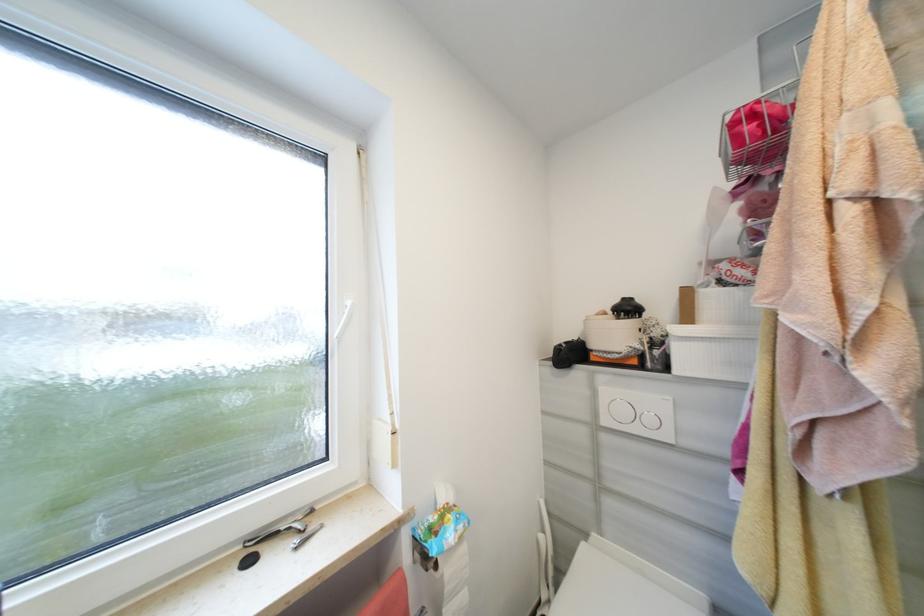
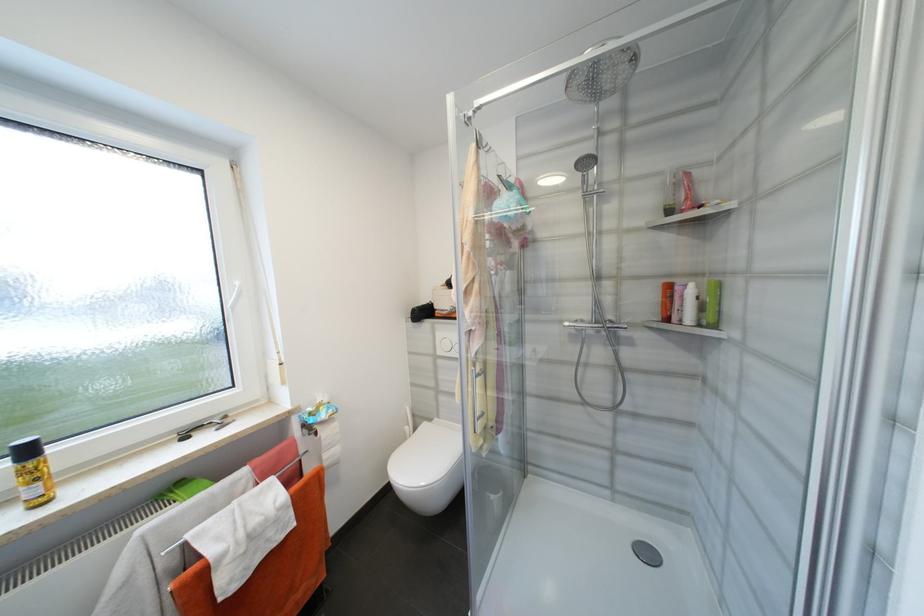
Find the pixel in the second image that matches (x=612, y=422) in the first image.

(445, 353)